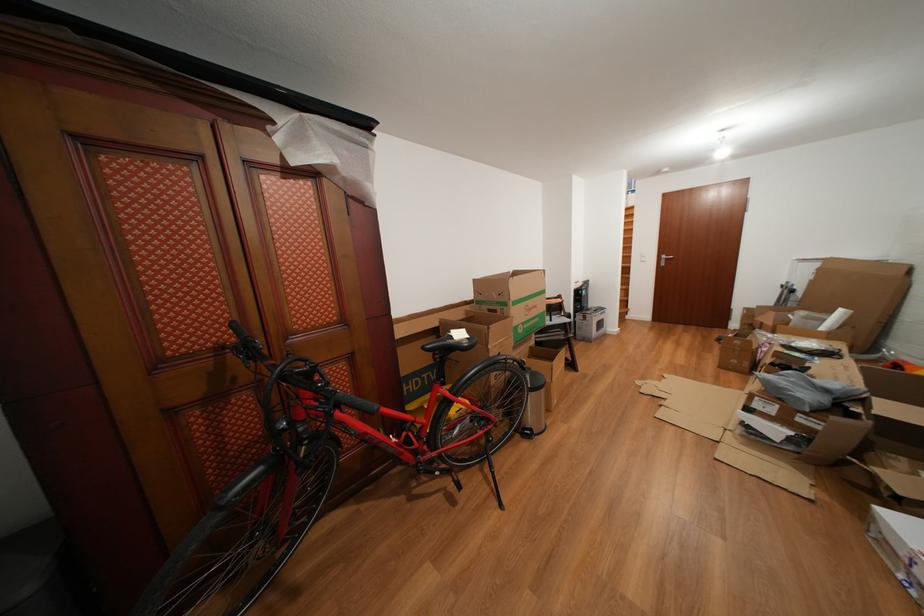
At what (x,y) coordinates should I click in order to perform the action: click on bicycle brake lever. Please return your answer as a coordinate pair (x, y). The width and height of the screenshot is (924, 616). Looking at the image, I should click on [241, 355].